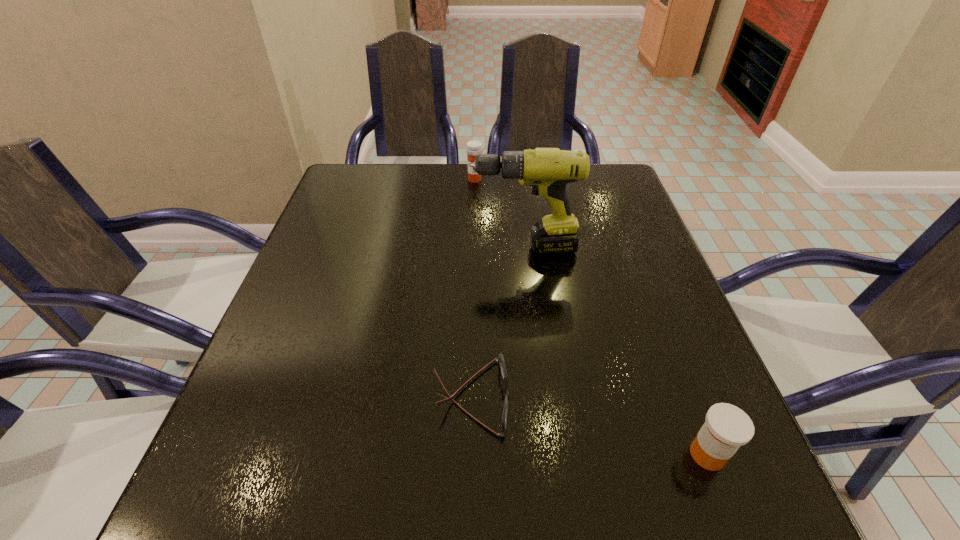
Image resolution: width=960 pixels, height=540 pixels. What are the coordinates of `the second farthest object` in the screenshot? It's located at (548, 170).

Identify the location of drill. (548, 170).

At what (x,y) coordinates should I click in order to perform the action: click on the farther medicine. Please return your answer as a coordinate pair (x, y). This screenshot has height=540, width=960. Looking at the image, I should click on (474, 148).

This screenshot has width=960, height=540. What are the coordinates of `the farthest object` in the screenshot? It's located at (474, 148).

The height and width of the screenshot is (540, 960). In order to click on the nearer medicine in this screenshot , I will do `click(727, 427)`.

Locate an element on the screen. the shorter medicine is located at coordinates (727, 427).

Where is `spectacles`? spectacles is located at coordinates (500, 360).

Find the location of `free spot located on the handle side of the second farthest object`. free spot located on the handle side of the second farthest object is located at coordinates (310, 247).

Image resolution: width=960 pixels, height=540 pixels. Find the location of `vacant space located on the handle side of the second farthest object`. vacant space located on the handle side of the second farthest object is located at coordinates (310, 247).

Find the location of a particular element. This screenshot has height=540, width=960. free space located on the handle side of the second farthest object is located at coordinates (358, 247).